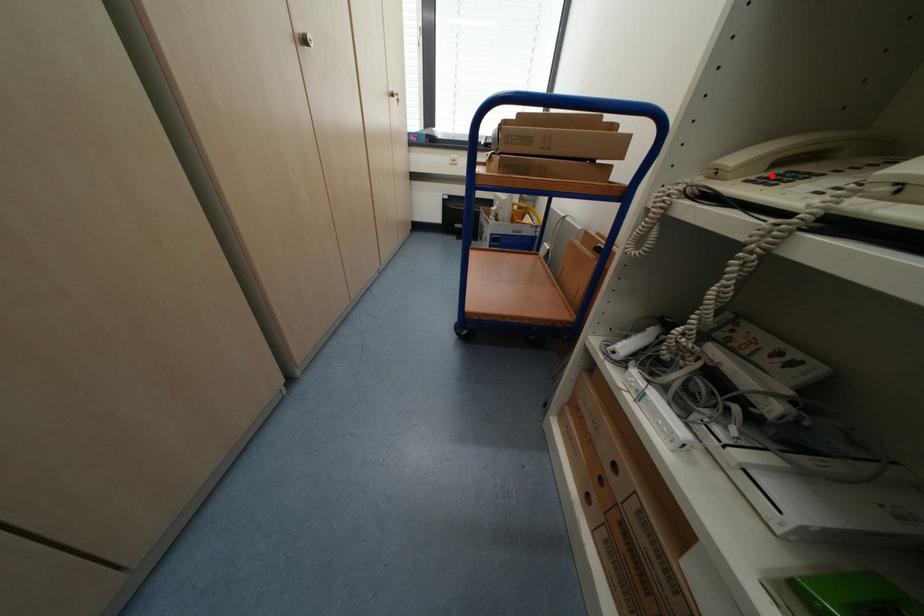
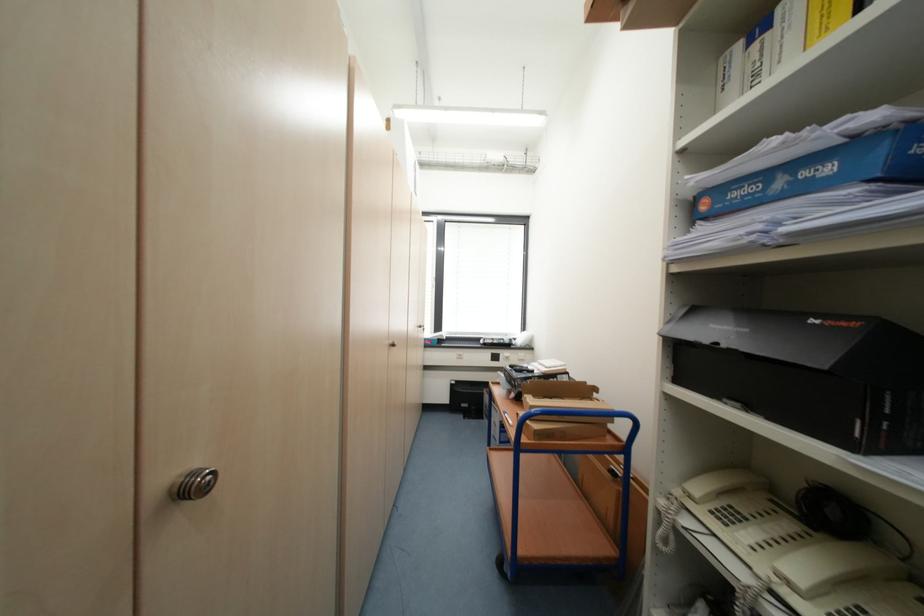
Locate, in the second image, the point that corresponds to the highlighted location in the first image.

(723, 507)